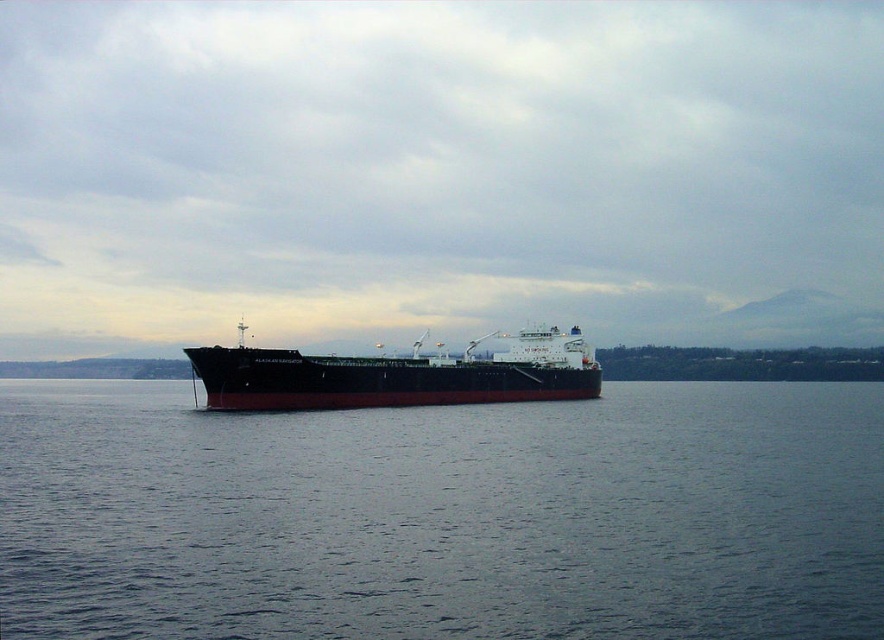
Between dark blue water at center and black matte ship at center, which one appears on the right side from the viewer's perspective?

black matte ship at center is more to the right.

Does dark blue water at center come behind black matte ship at center?

No, dark blue water at center is closer to the viewer.

Is point (812, 413) farther from viewer compared to point (392, 372)?

That is True.

Identify the location of dark blue water at center. [443, 516].